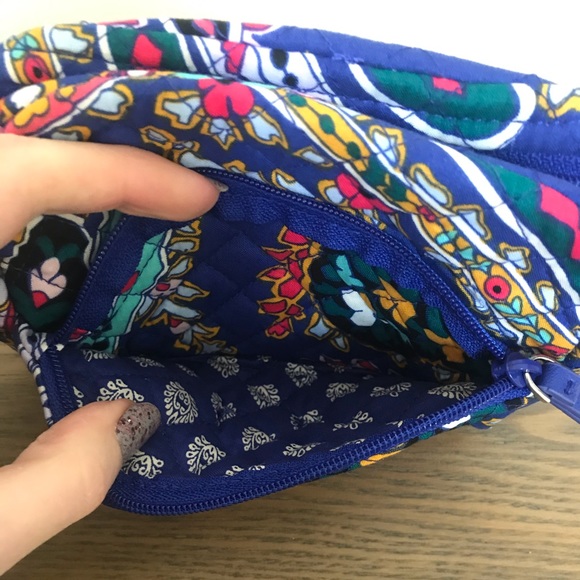
This screenshot has height=580, width=580. Find the location of `wood grain`. wood grain is located at coordinates (464, 474), (464, 493), (464, 508).